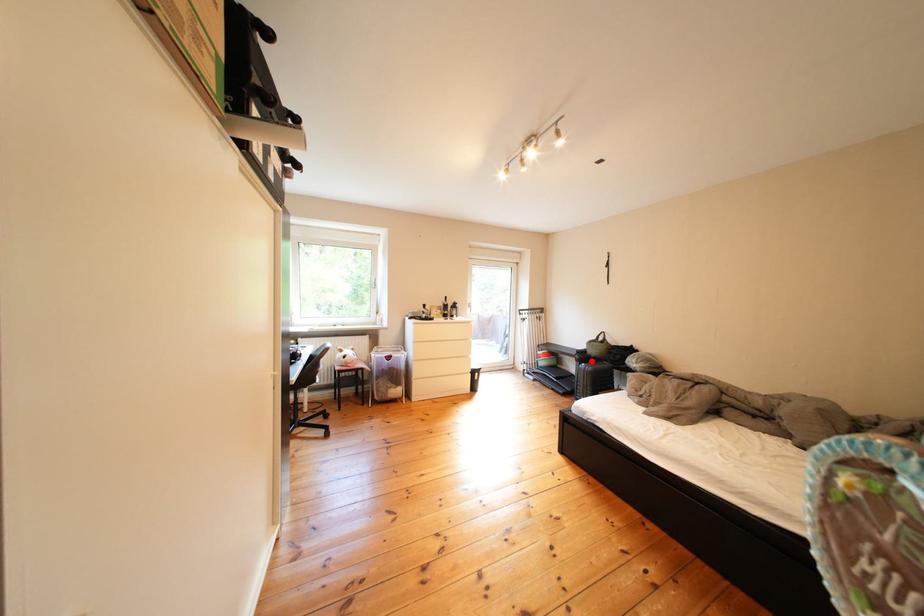
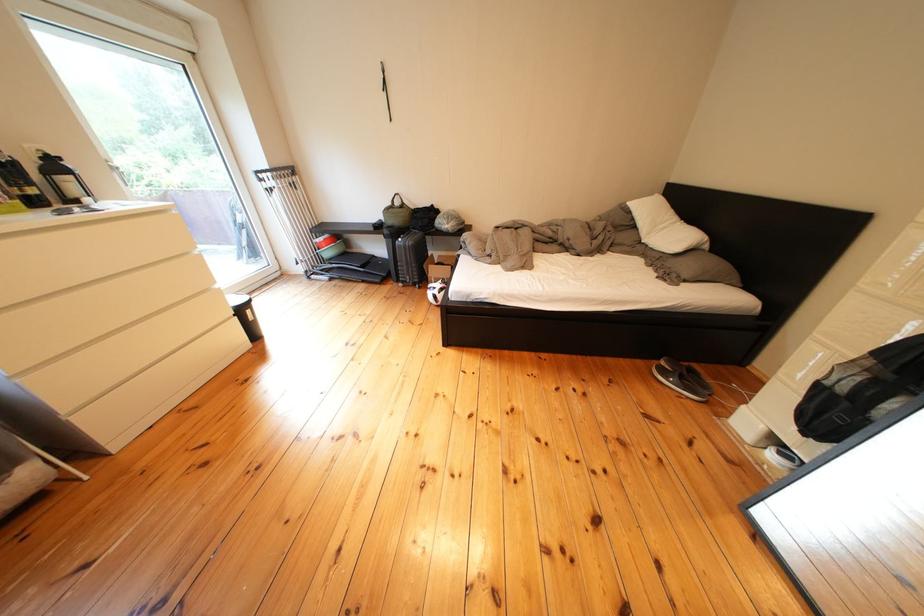
Question: I am providing you with two images of the same scene from different viewpoints. In image1, a red point is highlighted. Considering the same 3D point in image2, which of the following is correct?

Choices:
 (A) It is closer
 (B) It is farther

Answer: (B)